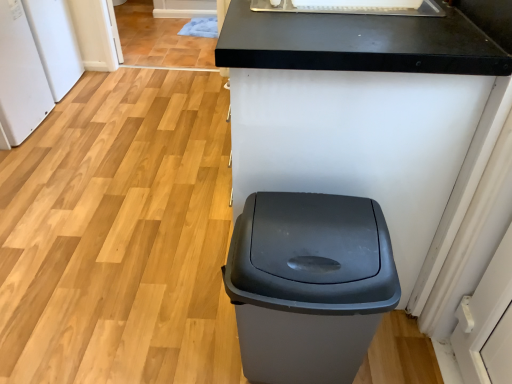
Question: From the image's perspective, is white matte refrigerator at left, acting as the 2th appliance starting from the back, located beneath matte gray plastic trash can at center?

Choices:
 (A) yes
 (B) no

Answer: (B)

Question: Is white matte refrigerator at left, acting as the 2th appliance starting from the back, facing towards matte gray plastic trash can at center?

Choices:
 (A) yes
 (B) no

Answer: (B)

Question: Is white matte refrigerator at left, acting as the 2th appliance starting from the back, not inside matte gray plastic trash can at center?

Choices:
 (A) yes
 (B) no

Answer: (A)

Question: Considering the relative sizes of white matte refrigerator at left, arranged as the first appliance when viewed from the front, and matte gray plastic trash can at center in the image provided, is white matte refrigerator at left, arranged as the first appliance when viewed from the front, bigger than matte gray plastic trash can at center?

Choices:
 (A) no
 (B) yes

Answer: (B)

Question: Considering the relative sizes of white matte refrigerator at left, arranged as the first appliance when viewed from the front, and matte gray plastic trash can at center in the image provided, is white matte refrigerator at left, arranged as the first appliance when viewed from the front, shorter than matte gray plastic trash can at center?

Choices:
 (A) no
 (B) yes

Answer: (A)

Question: Would you consider white matte refrigerator at left, acting as the 2th appliance starting from the back, to be distant from matte gray plastic trash can at center?

Choices:
 (A) no
 (B) yes

Answer: (B)

Question: Is white matte refrigerator at left, acting as the 2th appliance starting from the back, shorter than black matte counter at center?

Choices:
 (A) no
 (B) yes

Answer: (B)

Question: Can you confirm if white matte refrigerator at left, acting as the 2th appliance starting from the back, is thinner than black matte counter at center?

Choices:
 (A) no
 (B) yes

Answer: (B)

Question: Is white matte refrigerator at left, acting as the 2th appliance starting from the back, to the left of black matte counter at center from the viewer's perspective?

Choices:
 (A) no
 (B) yes

Answer: (B)

Question: Does white matte refrigerator at left, acting as the 2th appliance starting from the back, appear on the right side of black matte counter at center?

Choices:
 (A) yes
 (B) no

Answer: (B)

Question: Is white matte refrigerator at left, arranged as the first appliance when viewed from the front, oriented towards black matte counter at center?

Choices:
 (A) yes
 (B) no

Answer: (A)

Question: Does white matte refrigerator at left, acting as the 2th appliance starting from the back, have a larger size compared to black matte counter at center?

Choices:
 (A) yes
 (B) no

Answer: (B)

Question: From the image's perspective, is matte gray plastic trash can at center beneath white glossy sink at upper center?

Choices:
 (A) yes
 (B) no

Answer: (A)